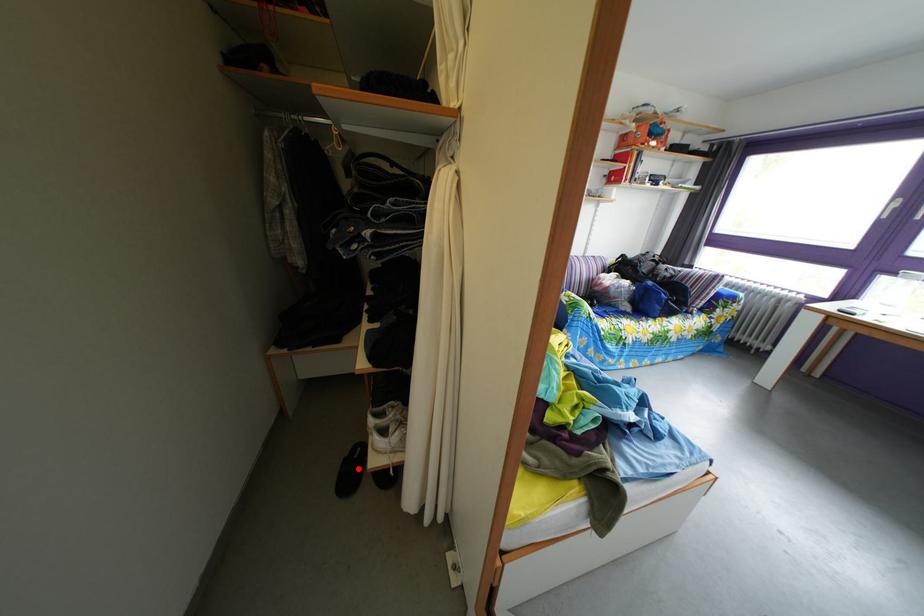
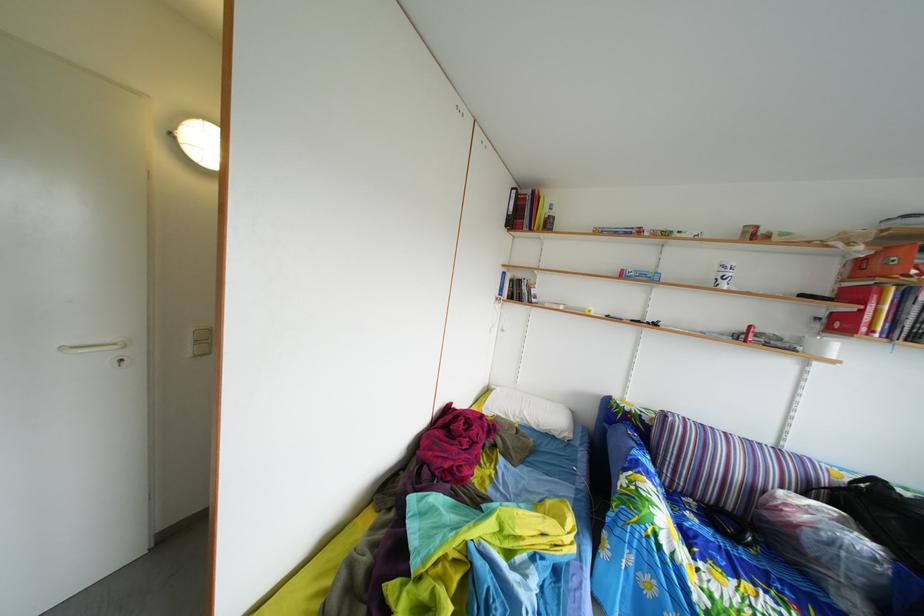
Question: I am providing you with two images of the same scene from different viewpoints. A red point is marked on the first image. Can you still see the location of the red point in image 2?

Choices:
 (A) Yes
 (B) No

Answer: (B)